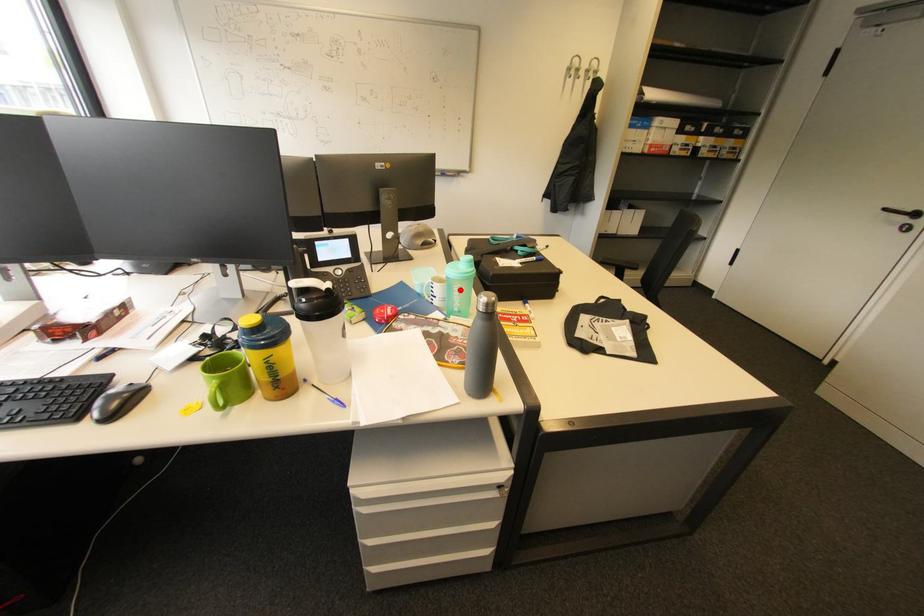
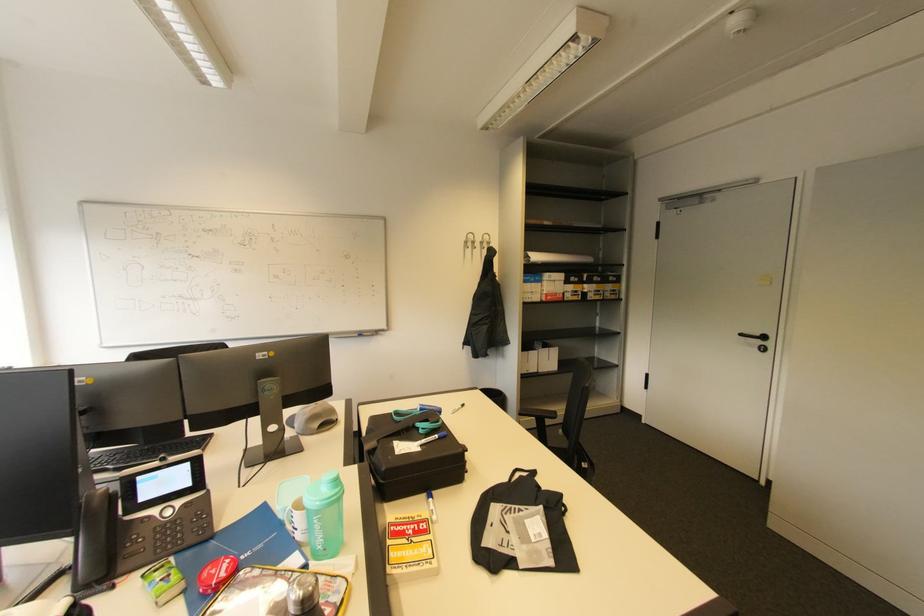
Where in the second image is the point corresponding to the highlighted location from the first image?

(320, 522)